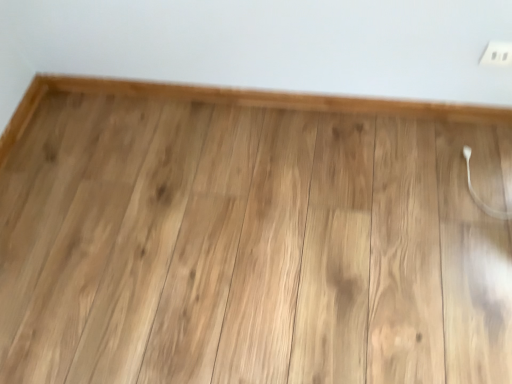
Find the location of a particular element. This screenshot has width=512, height=384. free point in front of light wood ledge at upper center is located at coordinates (283, 223).